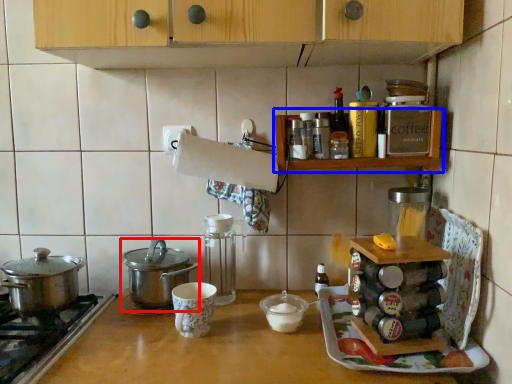
Question: Which of the following is the closest to the observer, kitchen appliance (highlighted by a red box) or shelf (highlighted by a blue box)?

Choices:
 (A) kitchen appliance
 (B) shelf

Answer: (B)